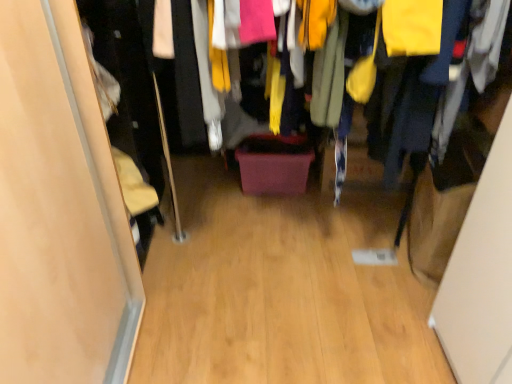
Question: Can wooden floor at center be found inside matte wood door at left?

Choices:
 (A) no
 (B) yes

Answer: (A)

Question: Considering the relative positions of matte wood door at left and wooden floor at center in the image provided, is matte wood door at left behind wooden floor at center?

Choices:
 (A) no
 (B) yes

Answer: (B)

Question: Is matte wood door at left thinner than wooden floor at center?

Choices:
 (A) yes
 (B) no

Answer: (A)

Question: Is matte wood door at left far from wooden floor at center?

Choices:
 (A) yes
 (B) no

Answer: (B)

Question: Considering the relative sizes of matte wood door at left and wooden floor at center in the image provided, is matte wood door at left taller than wooden floor at center?

Choices:
 (A) yes
 (B) no

Answer: (A)

Question: Is matte wood door at left oriented away from wooden floor at center?

Choices:
 (A) no
 (B) yes

Answer: (A)

Question: From a real-world perspective, is wooden floor at center physically above wooden floor at center?

Choices:
 (A) yes
 (B) no

Answer: (B)

Question: Does wooden floor at center have a smaller size compared to wooden floor at center?

Choices:
 (A) no
 (B) yes

Answer: (B)

Question: Is wooden floor at center aimed at wooden floor at center?

Choices:
 (A) yes
 (B) no

Answer: (B)

Question: Can we say wooden floor at center lies outside wooden floor at center?

Choices:
 (A) no
 (B) yes

Answer: (B)

Question: Is wooden floor at center closer to the viewer compared to wooden floor at center?

Choices:
 (A) yes
 (B) no

Answer: (B)

Question: Considering the relative sizes of wooden floor at center and wooden floor at center in the image provided, is wooden floor at center thinner than wooden floor at center?

Choices:
 (A) no
 (B) yes

Answer: (A)

Question: Can we say wooden floor at center lies outside wooden floor at center?

Choices:
 (A) yes
 (B) no

Answer: (A)